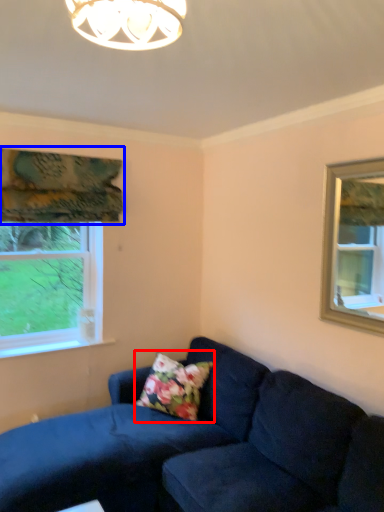
Question: Among these objects, which one is farthest to the camera, pillow (highlighted by a red box) or curtain (highlighted by a blue box)?

Choices:
 (A) pillow
 (B) curtain

Answer: (A)